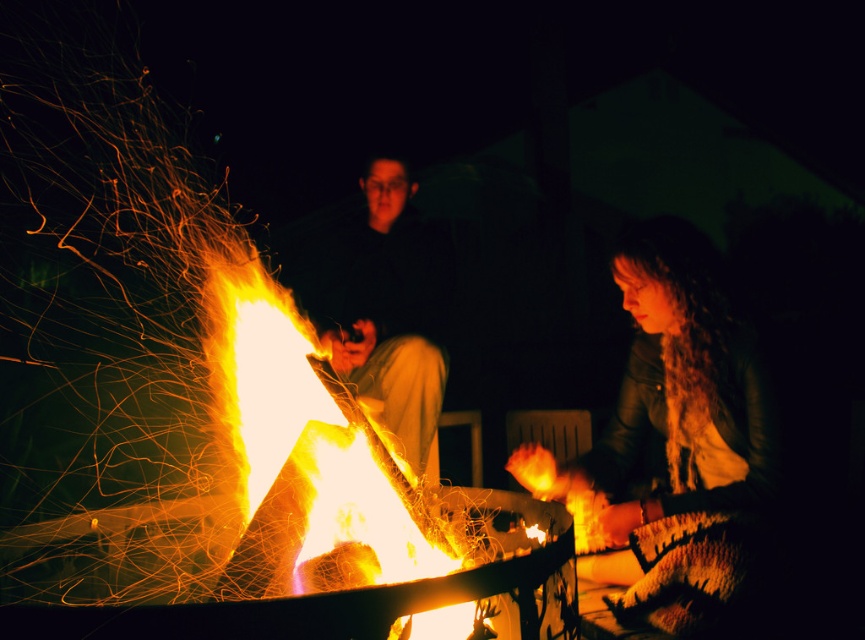
Based on the photo, you are trying to decide which jacket to take for warmth. Both the leather jacket at lower right and the matte black jacket at center are available. Based on their sizes, which one might be more suitable for covering your entire body?

The matte black jacket at center is taller than the leather jacket at lower right, so it might be more suitable for covering your entire body.

You are a hiker who just arrived at the campsite. You notice the flaming wood at center and the matte black jacket at center. Which object is closer to the ground?

The flaming wood at center is positioned under the matte black jacket at center, so it is closer to the ground.

You are trying to locate the flaming wood at center in the image. According to the coordinates provided, where exactly is it positioned?

The flaming wood at center is located at point coordinates of 0.747 in the x axis and 0.363 in the y axis.